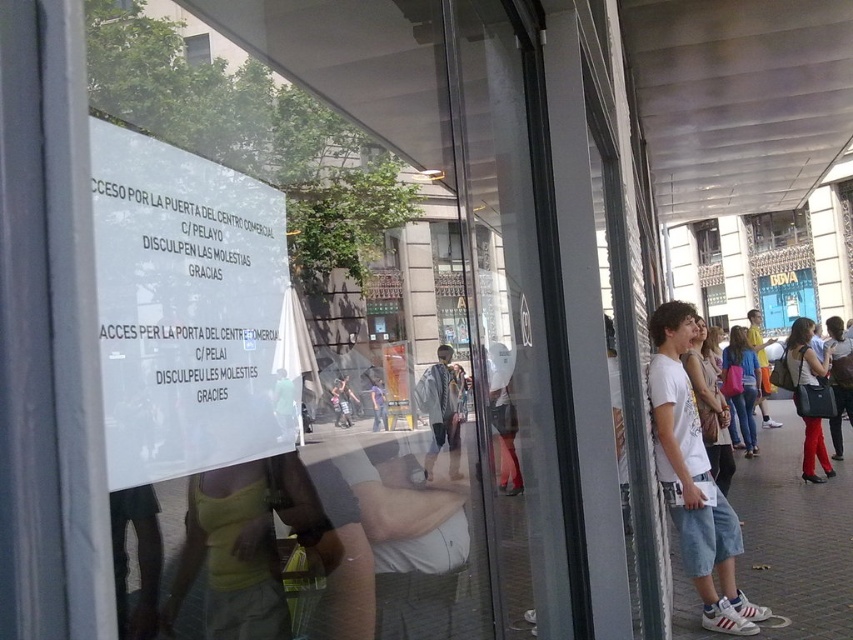
Can you confirm if white cotton shirt at right is positioned below matte pink bag at center?

No, white cotton shirt at right is not below matte pink bag at center.

Which of these two, white cotton shirt at right or matte pink bag at center, stands taller?

matte pink bag at center

Is point (715, 452) behind point (746, 390)?

No, it is in front of (746, 390).

The image size is (853, 640). In order to click on white cotton shirt at right in this screenshot , I will do tap(709, 406).

Is matte pink bag at center wider than clear glass window at center?

Yes.

Based on the photo, is matte pink bag at center to the left of clear glass window at center from the viewer's perspective?

Correct, you'll find matte pink bag at center to the left of clear glass window at center.

This screenshot has width=853, height=640. I want to click on matte pink bag at center, so click(741, 385).

Find the location of a particular element. The width and height of the screenshot is (853, 640). matte pink bag at center is located at coordinates (741, 385).

Does brown brick pavement at lower right have a greater width compared to white cotton t-shirt at center?

No, brown brick pavement at lower right is not wider than white cotton t-shirt at center.

Can you confirm if brown brick pavement at lower right is shorter than white cotton t-shirt at center?

Indeed, brown brick pavement at lower right has a lesser height compared to white cotton t-shirt at center.

Between point (799, 428) and point (654, 424), which one is positioned in front?

Point (654, 424) is in front.

This screenshot has width=853, height=640. I want to click on brown brick pavement at lower right, so (795, 536).